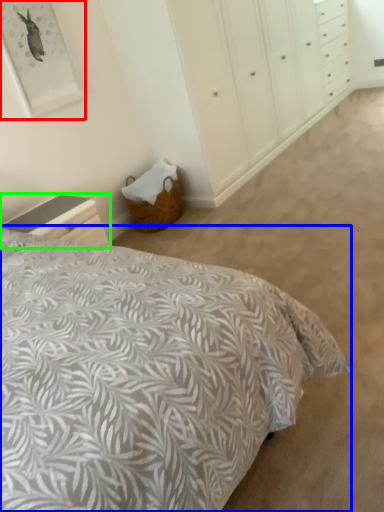
Question: Which object is positioned closest to picture frame (highlighted by a red box)? Select from bed (highlighted by a blue box) and nightstand (highlighted by a green box).

Choices:
 (A) bed
 (B) nightstand

Answer: (B)